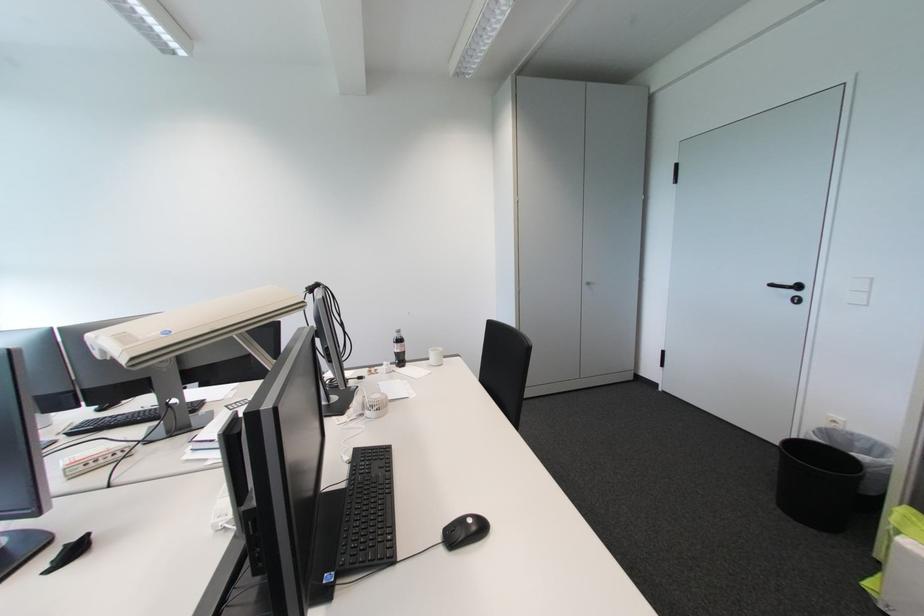
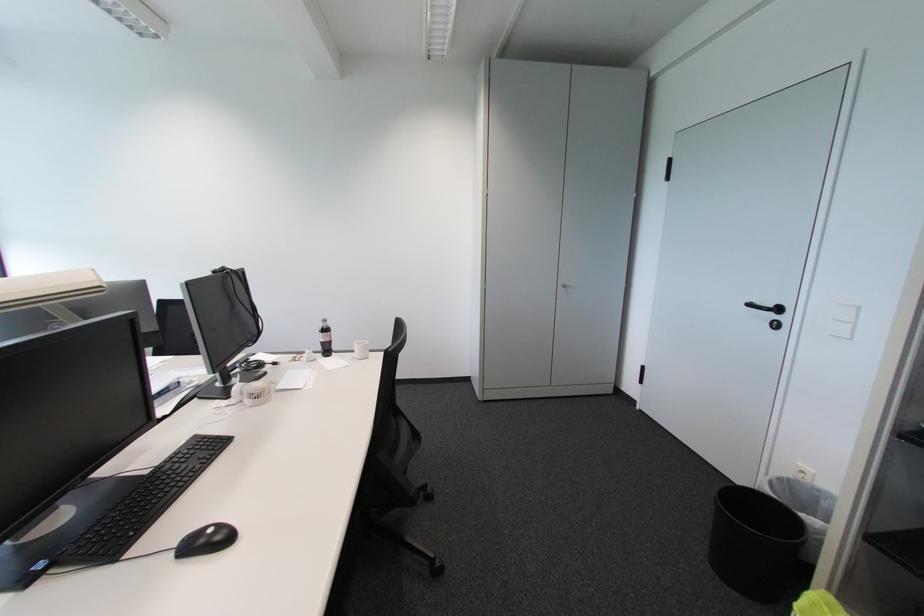
Find the pixel in the second image that matches point (447, 551) in the first image.

(177, 557)